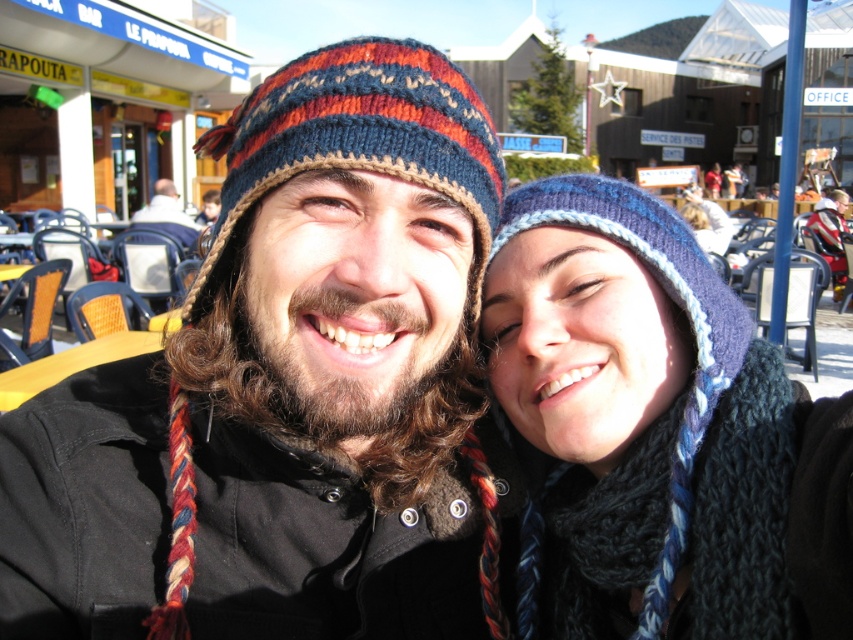
Does point (581, 426) lie in front of point (456, 128)?

That is False.

Does blue knitted hat at center lie in front of knitted woolen hat at center?

Yes, it is.

Between point (683, 266) and point (263, 99), which one is positioned in front?

Point (263, 99) is more forward.

The width and height of the screenshot is (853, 640). In order to click on blue knitted hat at center in this screenshot , I will do `click(657, 433)`.